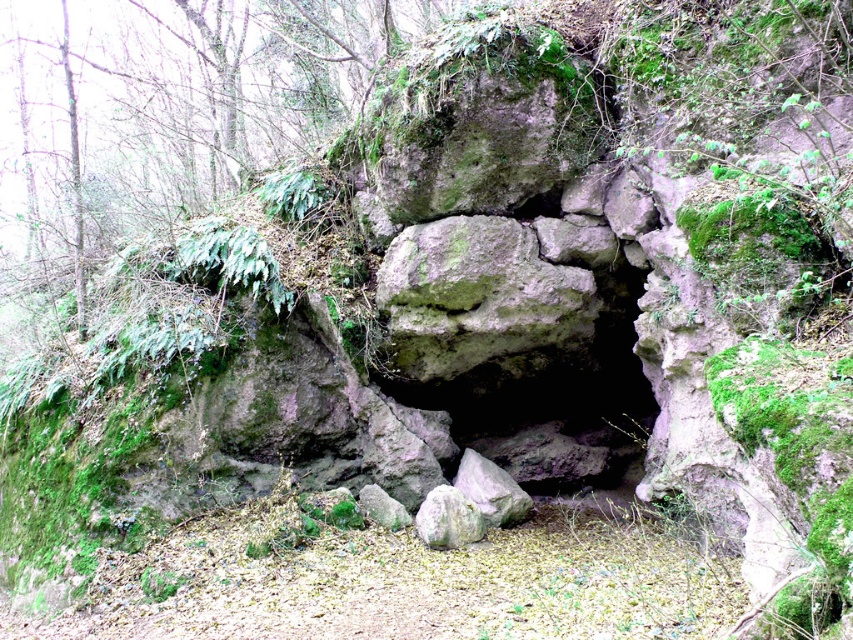
Looking at this image, you are standing at the entrance of the cave and want to place a small marker at both point (x=428, y=516) and point (x=364, y=509). Which point will require you to walk further into the cave to reach?

Point (x=364, y=509) will require walking further into the cave because it is farther from the camera compared to point (x=428, y=516).

You are exploring a forest and come across a rock formation. You notice a point marked at coordinates (x=477, y=298). What object is located at that specific point?

The green mossy rock at center is located at point (x=477, y=298).